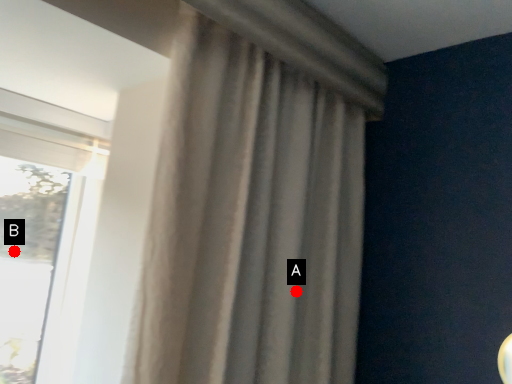
Question: Two points are circled on the image, labeled by A and B beside each circle. Among these points, which one is nearest to the camera?

Choices:
 (A) A is closer
 (B) B is closer

Answer: (A)